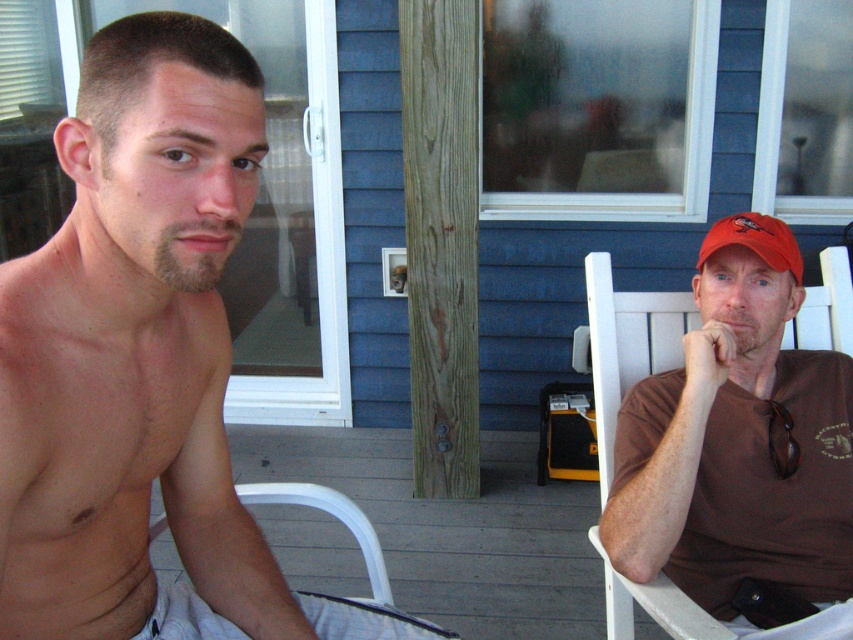
You are a photographer trying to capture a closeup of the facial features of both individuals. Given that the beige soft facial hair at center and the red matte baseball cap at right are in the frame, which object would require you to move closer to the subject to get a detailed shot?

The beige soft facial hair at center has a smaller size compared to the red matte baseball cap at right, so to capture a detailed closeup of the beige soft facial hair at center, you would need to move closer to the subject since it is smaller and requires more focus.

You are a photographer adjusting lighting for a portrait. You notice the shiny skin at left and the brown matte shirt at right in your frame. Which object might require a reflector to reduce glare?

The shiny skin at left requires a reflector to reduce glare because it is much taller than the brown matte shirt at right, making it more prone to reflecting light.